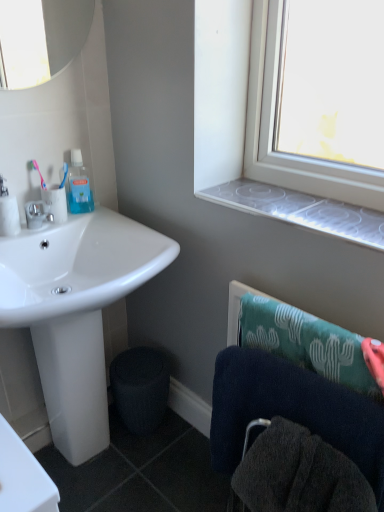
The image size is (384, 512). I want to click on blank space above transparent plastic window sill at upper right (from a real-world perspective), so click(x=297, y=208).